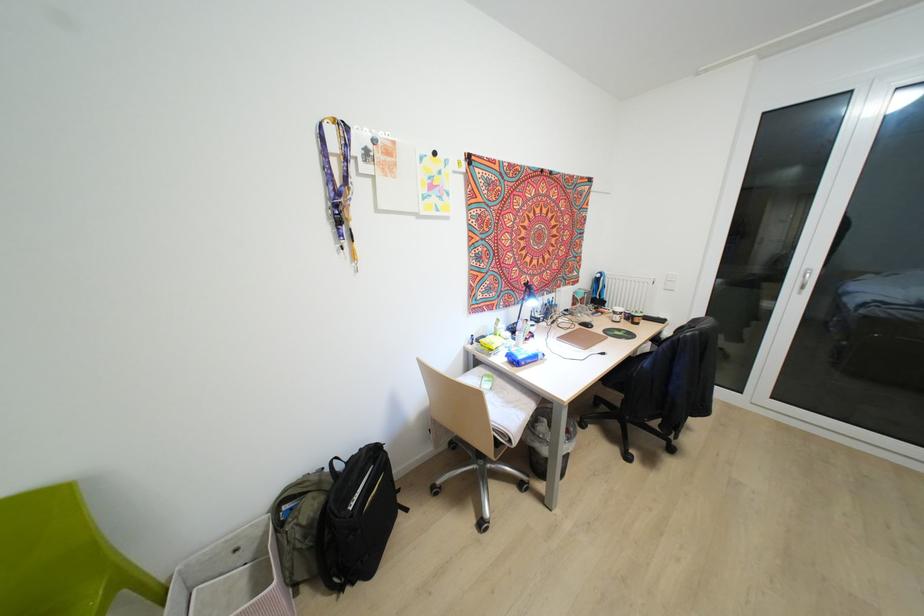
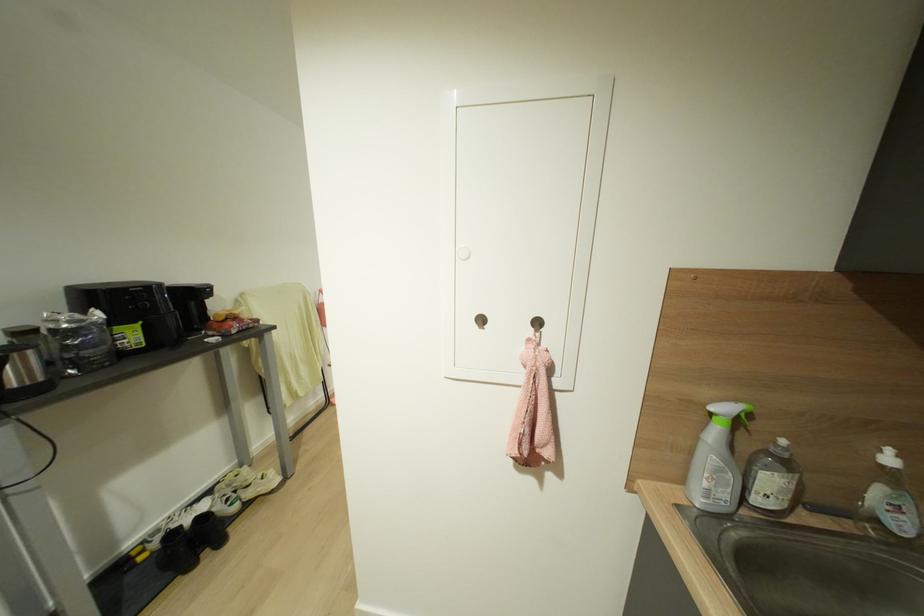
Question: I am providing you with two images of the same scene from different viewpoints. Please identify which objects are invisible in image2.

Choices:
 (A) soap dispenser pump
 (B) black computer mouse
 (C) USB port
 (D) white sneaker

Answer: (B)